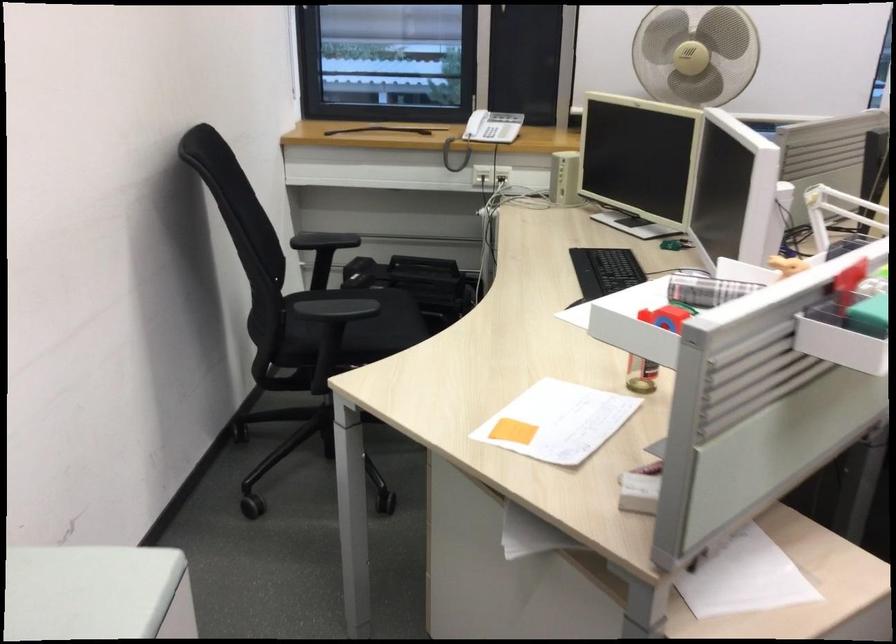
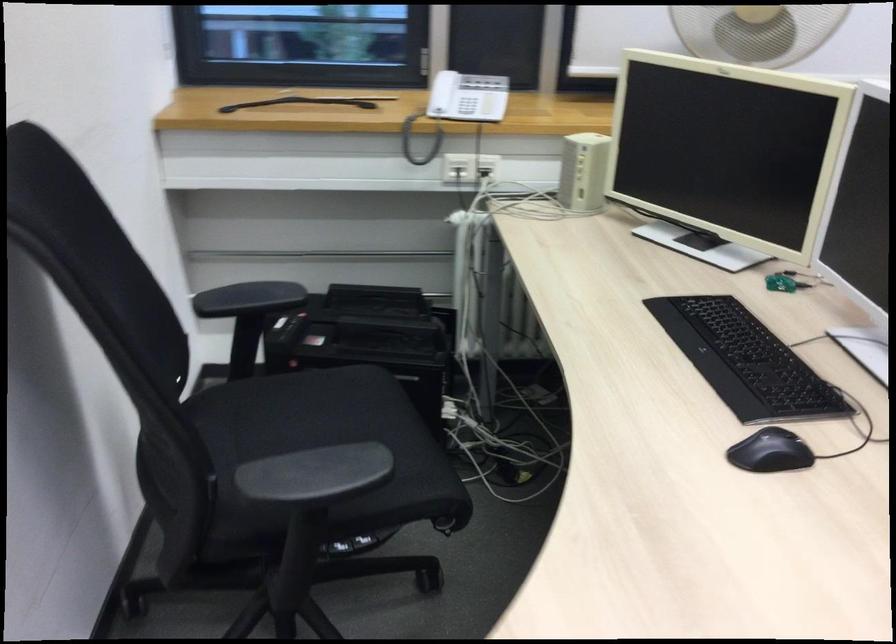
Question: Which direction would the cameraman need to move to produce the second image? Reply with the corresponding letter.

Choices:
 (A) Left
 (B) Right
 (C) Forward
 (D) Backward

Answer: (C)